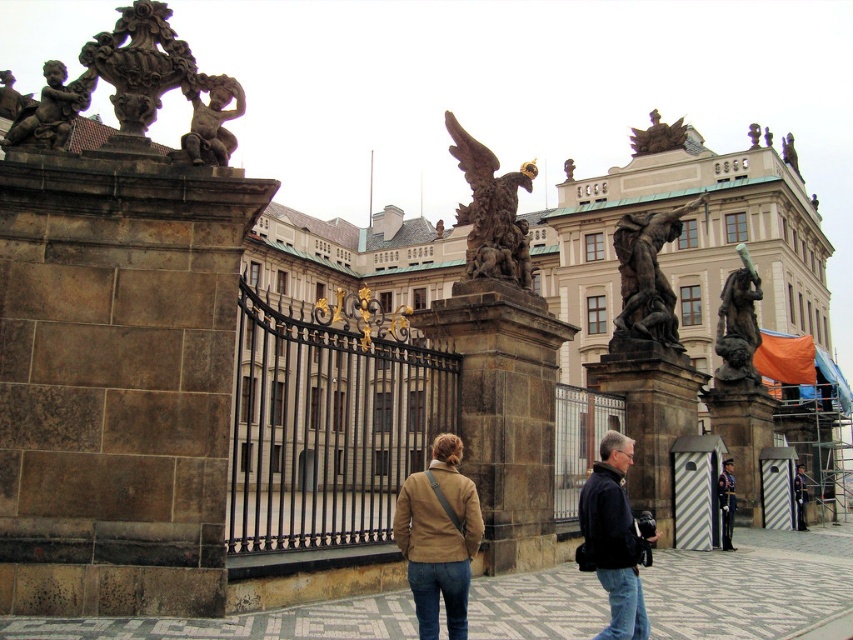
Who is positioned more to the left, camel leather jacket at center or carved stone cherub at upper left?

carved stone cherub at upper left

Does point (407, 557) come farther from viewer compared to point (160, 77)?

No, (407, 557) is closer to viewer.

This screenshot has height=640, width=853. I want to click on camel leather jacket at center, so click(439, 538).

You are a GUI agent. You are given a task and a screenshot of the screen. Output one action in this format:
    pyautogui.click(x=<x>, y=<y>)
    Task: Click on the camel leather jacket at center
    The image size is (853, 640).
    Given the screenshot: What is the action you would take?
    pyautogui.click(x=439, y=538)

Consider the image. Which of these two, brown leather jacket at center or carved stone cherub at upper left, stands taller?

brown leather jacket at center is taller.

Does brown leather jacket at center have a smaller size compared to carved stone cherub at upper left?

No, brown leather jacket at center is not smaller than carved stone cherub at upper left.

Is point (471, 524) positioned in front of point (109, 44)?

Yes.

Find the location of a particular element. Image resolution: width=853 pixels, height=640 pixels. brown leather jacket at center is located at coordinates (614, 540).

Between camel leather jacket at center and bronze cherub at upper left, which one is positioned higher?

bronze cherub at upper left is above.

How far apart are camel leather jacket at center and bronze cherub at upper left?

The distance of camel leather jacket at center from bronze cherub at upper left is 46.43 feet.

Does point (415, 497) come in front of point (219, 140)?

Yes, point (415, 497) is closer to viewer.

Locate an element on the screen. The width and height of the screenshot is (853, 640). camel leather jacket at center is located at coordinates (439, 538).